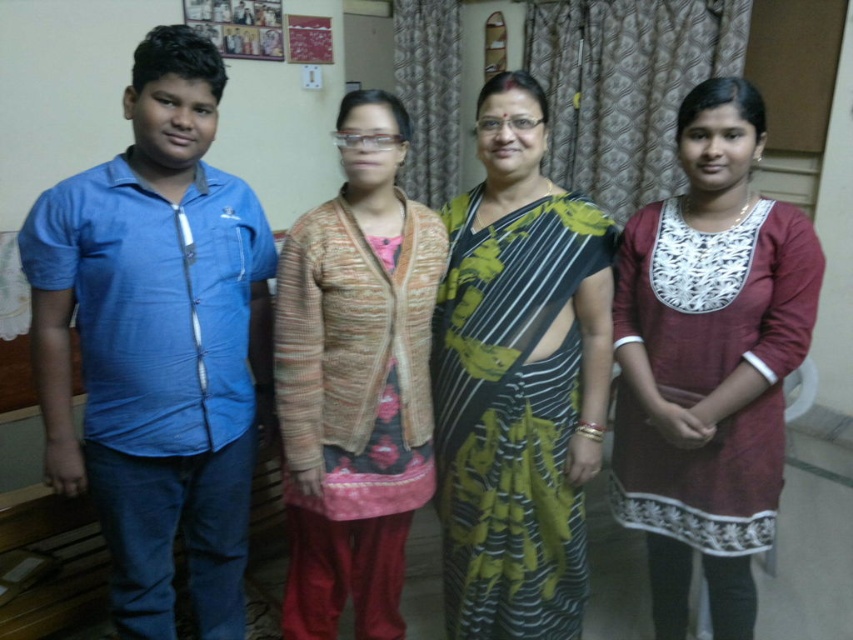
Is black and green striped saree at center smaller than knitted sweater at center?

Yes.

Does black and green striped saree at center appear over knitted sweater at center?

Yes, black and green striped saree at center is above knitted sweater at center.

The width and height of the screenshot is (853, 640). Describe the element at coordinates (518, 380) in the screenshot. I see `black and green striped saree at center` at that location.

Identify the location of black and green striped saree at center. (518, 380).

Does black and green striped saree at center appear under maroon cotton kurta at right?

No, black and green striped saree at center is not below maroon cotton kurta at right.

Can you confirm if black and green striped saree at center is shorter than maroon cotton kurta at right?

Yes, black and green striped saree at center is shorter than maroon cotton kurta at right.

Does point (494, 339) come behind point (712, 422)?

That is True.

Where is `black and green striped saree at center`? This screenshot has height=640, width=853. black and green striped saree at center is located at coordinates (518, 380).

Is maroon cotton kurta at right bigger than knitted sweater at center?

Indeed, maroon cotton kurta at right has a larger size compared to knitted sweater at center.

Looking at this image, between maroon cotton kurta at right and knitted sweater at center, which one appears on the right side from the viewer's perspective?

From the viewer's perspective, maroon cotton kurta at right appears more on the right side.

Does point (724, 605) lie in front of point (386, 124)?

No.

Where is `maroon cotton kurta at right`? Image resolution: width=853 pixels, height=640 pixels. maroon cotton kurta at right is located at coordinates (708, 362).